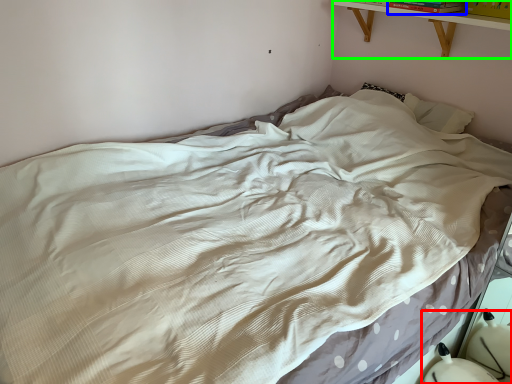
Question: Which object is the farthest from swivel chair (highlighted by a red box)? Choose among these: book (highlighted by a blue box) or shelf (highlighted by a green box).

Choices:
 (A) book
 (B) shelf

Answer: (A)